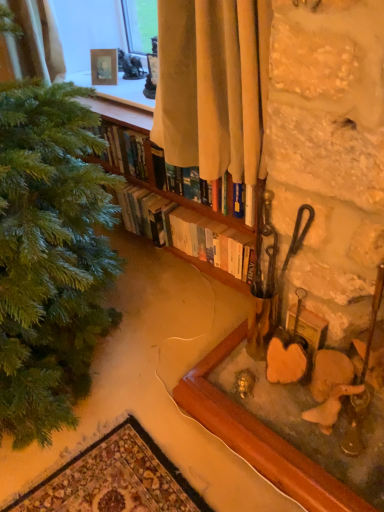
Question: From the image's perspective, is beige fabric curtain at upper center above or below wooden frame at upper center, marked as the second picture frame in a front-to-back arrangement?

Choices:
 (A) below
 (B) above

Answer: (A)

Question: In the image, is beige fabric curtain at upper center positioned in front of or behind wooden frame at upper center, the first picture frame from the top?

Choices:
 (A) front
 (B) behind

Answer: (A)

Question: Estimate the real-world distances between objects in this image. Which object is farther from the hardcover books at center?

Choices:
 (A) wooden picture frame at lower right, arranged as the 2th picture frame when viewed from the left
 (B) beige fabric curtain at upper center
 (C) wooden frame at upper center, the 1th picture frame positioned from the left

Answer: (A)

Question: Which of these objects is positioned farthest from the hardcover books at center?

Choices:
 (A) wooden frame at upper center, the first picture frame from the top
 (B) wooden picture frame at lower right, acting as the 2th picture frame starting from the back
 (C) beige fabric curtain at upper center

Answer: (B)